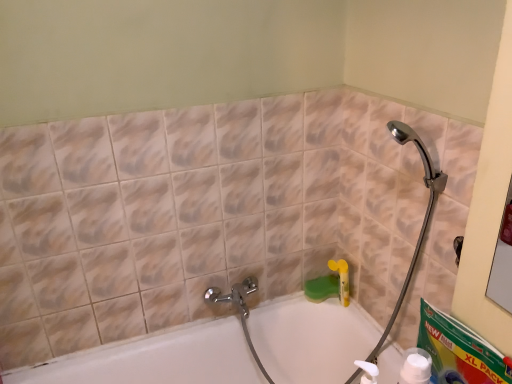
Question: Is white plastic bottle at lower right thinner than white glossy bathtub at center?

Choices:
 (A) yes
 (B) no

Answer: (A)

Question: Can white glossy bathtub at center be found inside white plastic bottle at lower right?

Choices:
 (A) no
 (B) yes

Answer: (A)

Question: From a real-world perspective, is white plastic bottle at lower right on top of white glossy bathtub at center?

Choices:
 (A) yes
 (B) no

Answer: (A)

Question: From the image's perspective, does white plastic bottle at lower right appear higher than white glossy bathtub at center?

Choices:
 (A) yes
 (B) no

Answer: (A)

Question: Is white plastic bottle at lower right not within white glossy bathtub at center?

Choices:
 (A) no
 (B) yes

Answer: (B)

Question: Does white plastic bottle at lower right have a greater height compared to white glossy bathtub at center?

Choices:
 (A) no
 (B) yes

Answer: (A)

Question: Considering the relative sizes of white glossy bathtub at center and white plastic bottle at lower right in the image provided, is white glossy bathtub at center smaller than white plastic bottle at lower right?

Choices:
 (A) no
 (B) yes

Answer: (A)

Question: Does white glossy bathtub at center have a lesser width compared to white plastic bottle at lower right?

Choices:
 (A) no
 (B) yes

Answer: (A)

Question: Does white glossy bathtub at center come behind white plastic bottle at lower right?

Choices:
 (A) no
 (B) yes

Answer: (B)

Question: Does white glossy bathtub at center have a greater width compared to white plastic bottle at lower right?

Choices:
 (A) yes
 (B) no

Answer: (A)

Question: Can you see white glossy bathtub at center touching white plastic bottle at lower right?

Choices:
 (A) no
 (B) yes

Answer: (A)

Question: Does white glossy bathtub at center come in front of white plastic bottle at lower right?

Choices:
 (A) no
 (B) yes

Answer: (A)

Question: Is point (415, 380) closer or farther from the camera than point (206, 322)?

Choices:
 (A) closer
 (B) farther

Answer: (A)